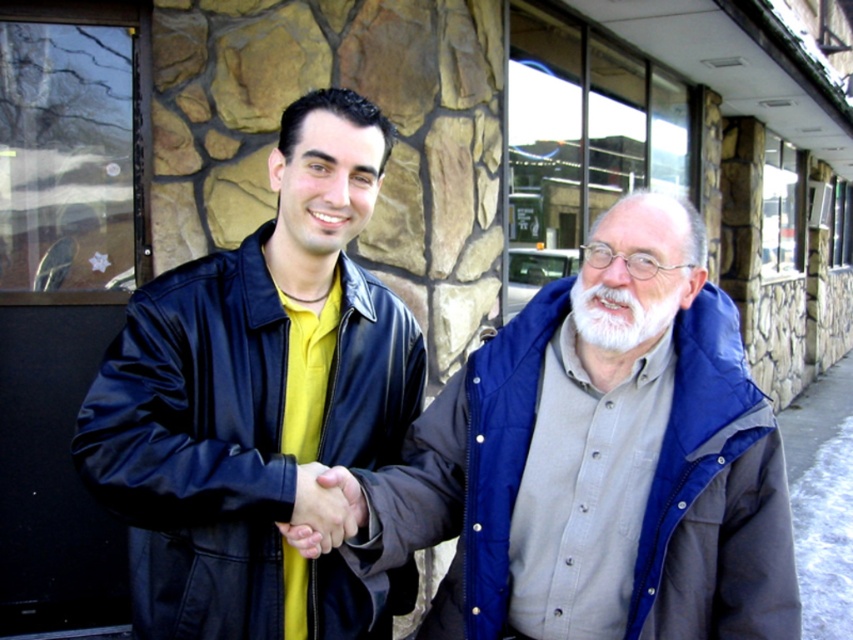
You are a photographer trying to capture a closeup of the smooth leather hand at center. However, the matte black jacket at left is blocking your view. Can you move the jacket to the right to get a clear shot?

The matte black jacket at left is positioned on the left side of the smooth leather hand at center. Moving the jacket to the right would place it behind the hand, allowing you to capture the smooth leather hand at center without obstruction.

You are a photographer trying to capture both the matte black jacket at left and the gray concrete pavement at lower right in a single frame. Based on their sizes, which object should you focus on first to ensure both are in focus?

The matte black jacket at left is bigger than the gray concrete pavement at lower right, so you should focus on the matte black jacket at left first to ensure both are in focus.

You are trying to decide if the matte black jacket at left can be placed on the gray concrete pavement at lower right. Based on their sizes, is this possible?

The matte black jacket at left might be wider than gray concrete pavement at lower right, so it may not fit properly.